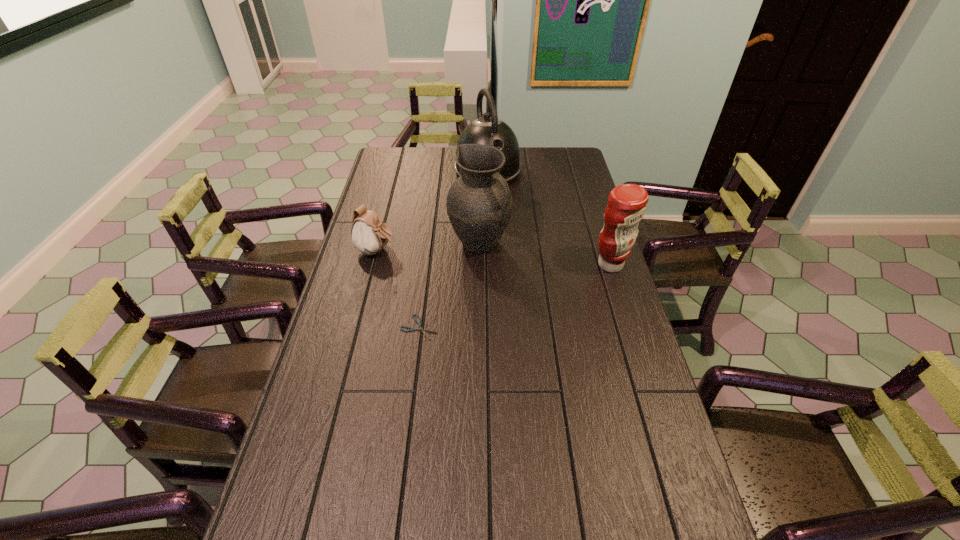
Identify the location of vacant region located 0.220m on the side of the pitcher with the handle. This screenshot has height=540, width=960. click(549, 290).

Where is `free space located on the side of the pitcher with the handle`? The height and width of the screenshot is (540, 960). free space located on the side of the pitcher with the handle is located at coordinates (522, 272).

Find the location of `free space located on the side of the pitcher with the handle`. free space located on the side of the pitcher with the handle is located at coordinates pos(573,307).

What are the coordinates of `free space located on the spout of the farthest object` in the screenshot? It's located at (502, 200).

This screenshot has width=960, height=540. What are the coordinates of `vacant region located 0.140m on the spout of the farthest object` in the screenshot? It's located at (507, 210).

Find the location of a particular element. vacant space situated 0.340m on the spout of the farthest object is located at coordinates (523, 241).

What are the coordinates of `free location located on the front-facing side of the leftmost object` in the screenshot? It's located at (435, 266).

Locate an element on the screen. free spot located on the front-facing side of the leftmost object is located at coordinates (417, 261).

Locate an element on the screen. vacant position located on the front-facing side of the leftmost object is located at coordinates [420, 262].

Where is `object at the far edge`? Image resolution: width=960 pixels, height=540 pixels. object at the far edge is located at coordinates (486, 130).